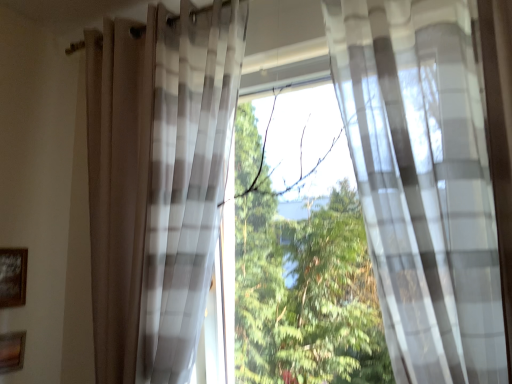
Where is `wooden framed picture at lower left, the 2th picture frame ordered from the bottom`? This screenshot has height=384, width=512. wooden framed picture at lower left, the 2th picture frame ordered from the bottom is located at coordinates (13, 276).

Is wooden framed picture at lower left, which is the first picture frame from top to bottom, placed right next to translucent white curtain at center, the 1th curtain viewed from the right?

wooden framed picture at lower left, which is the first picture frame from top to bottom, and translucent white curtain at center, the 1th curtain viewed from the right, are not in contact.

From the image's perspective, who appears lower, wooden framed picture at lower left, which is the first picture frame from top to bottom, or translucent white curtain at center, arranged as the 2th curtain when viewed from the left?

wooden framed picture at lower left, which is the first picture frame from top to bottom, is shown below in the image.

The height and width of the screenshot is (384, 512). Find the location of `the 2nd curtain above the wooden framed picture at lower left, which is the first picture frame from top to bottom (from a real-world perspective)`. the 2nd curtain above the wooden framed picture at lower left, which is the first picture frame from top to bottom (from a real-world perspective) is located at coordinates (422, 183).

Which is correct: translucent plaid curtain at center, which appears as the 2th curtain when viewed from the right, is inside wooden picture frame at lower left, marked as the second picture frame in a top-to-bottom arrangement, or outside of it?

translucent plaid curtain at center, which appears as the 2th curtain when viewed from the right, is located beyond the bounds of wooden picture frame at lower left, marked as the second picture frame in a top-to-bottom arrangement.

Is translucent plaid curtain at center, which is the 1th curtain in left-to-right order, turned away from wooden picture frame at lower left, the 1th picture frame in the bottom-to-top sequence?

No, wooden picture frame at lower left, the 1th picture frame in the bottom-to-top sequence, is not at the back of translucent plaid curtain at center, which is the 1th curtain in left-to-right order.

Considering the points (146, 157) and (23, 331), which point is behind, point (146, 157) or point (23, 331)?

Positioned behind is point (23, 331).

In terms of size, does wooden picture frame at lower left, the 1th picture frame in the bottom-to-top sequence, appear bigger or smaller than translucent white curtain at center, the 1th curtain viewed from the right?

wooden picture frame at lower left, the 1th picture frame in the bottom-to-top sequence, is smaller than translucent white curtain at center, the 1th curtain viewed from the right.

From the image's perspective, is wooden picture frame at lower left, marked as the second picture frame in a top-to-bottom arrangement, over translucent white curtain at center, arranged as the 2th curtain when viewed from the left?

No, from the image's perspective, wooden picture frame at lower left, marked as the second picture frame in a top-to-bottom arrangement, is not above translucent white curtain at center, arranged as the 2th curtain when viewed from the left.

Measure the distance from wooden picture frame at lower left, marked as the second picture frame in a top-to-bottom arrangement, to translucent white curtain at center, arranged as the 2th curtain when viewed from the left.

wooden picture frame at lower left, marked as the second picture frame in a top-to-bottom arrangement, and translucent white curtain at center, arranged as the 2th curtain when viewed from the left, are 5.85 feet apart from each other.

Between wooden picture frame at lower left, marked as the second picture frame in a top-to-bottom arrangement, and translucent white curtain at center, arranged as the 2th curtain when viewed from the left, which one has smaller width?

wooden picture frame at lower left, marked as the second picture frame in a top-to-bottom arrangement, is thinner.

Is wooden framed picture at lower left, the 2th picture frame ordered from the bottom, completely or partially outside of wooden picture frame at lower left, marked as the second picture frame in a top-to-bottom arrangement?

wooden framed picture at lower left, the 2th picture frame ordered from the bottom, is positioned outside wooden picture frame at lower left, marked as the second picture frame in a top-to-bottom arrangement.

Locate an element on the screen. picture frame above the wooden picture frame at lower left, marked as the second picture frame in a top-to-bottom arrangement (from the image's perspective) is located at coordinates (13, 276).

Can you confirm if wooden framed picture at lower left, which is the first picture frame from top to bottom, is bigger than wooden picture frame at lower left, marked as the second picture frame in a top-to-bottom arrangement?

Yes.

Which is farther, (4, 302) or (2, 355)?

Positioned behind is point (4, 302).

Can you confirm if translucent white curtain at center, the 1th curtain viewed from the right, is positioned to the right of wooden picture frame at lower left, the 1th picture frame in the bottom-to-top sequence?

Yes, translucent white curtain at center, the 1th curtain viewed from the right, is to the right of wooden picture frame at lower left, the 1th picture frame in the bottom-to-top sequence.

From a real-world perspective, is translucent white curtain at center, the 1th curtain viewed from the right, physically located above or below wooden picture frame at lower left, marked as the second picture frame in a top-to-bottom arrangement?

In terms of real-world spatial position, translucent white curtain at center, the 1th curtain viewed from the right, is above wooden picture frame at lower left, marked as the second picture frame in a top-to-bottom arrangement.

Which point is more distant from viewer, (x=345, y=66) or (x=4, y=365)?

The point (x=4, y=365) is behind.

Consider the image. Who is bigger, translucent white curtain at center, arranged as the 2th curtain when viewed from the left, or wooden picture frame at lower left, marked as the second picture frame in a top-to-bottom arrangement?

Bigger between the two is translucent white curtain at center, arranged as the 2th curtain when viewed from the left.

What's the angular difference between translucent plaid curtain at center, which appears as the 2th curtain when viewed from the right, and wooden framed picture at lower left, which is the first picture frame from top to bottom,'s facing directions?

They differ by 90 degrees in their facing directions.

Does translucent plaid curtain at center, which appears as the 2th curtain when viewed from the right, appear on the left side of wooden framed picture at lower left, which is the first picture frame from top to bottom?

No, translucent plaid curtain at center, which appears as the 2th curtain when viewed from the right, is not to the left of wooden framed picture at lower left, which is the first picture frame from top to bottom.

From the wooden framed picture at lower left, the 2th picture frame ordered from the bottom, count 1st curtains forward and point to it. Please provide its 2D coordinates.

[(158, 179)]

Are translucent plaid curtain at center, which appears as the 2th curtain when viewed from the right, and wooden framed picture at lower left, which is the first picture frame from top to bottom, making contact?

No, translucent plaid curtain at center, which appears as the 2th curtain when viewed from the right, is not in contact with wooden framed picture at lower left, which is the first picture frame from top to bottom.

Would you consider wooden picture frame at lower left, the 1th picture frame in the bottom-to-top sequence, to be distant from translucent plaid curtain at center, which is the 1th curtain in left-to-right order?

Yes, wooden picture frame at lower left, the 1th picture frame in the bottom-to-top sequence, and translucent plaid curtain at center, which is the 1th curtain in left-to-right order, are quite far apart.

Starting from the translucent plaid curtain at center, which is the 1th curtain in left-to-right order, which picture frame is the 1st one to the left? Please provide its 2D coordinates.

[(12, 351)]

Considering the positions of objects wooden picture frame at lower left, marked as the second picture frame in a top-to-bottom arrangement, and translucent plaid curtain at center, which appears as the 2th curtain when viewed from the right, in the image provided, who is in front, wooden picture frame at lower left, marked as the second picture frame in a top-to-bottom arrangement, or translucent plaid curtain at center, which appears as the 2th curtain when viewed from the right,?

translucent plaid curtain at center, which appears as the 2th curtain when viewed from the right, is in front.

From a real-world perspective, which curtain is the 2nd one above the wooden framed picture at lower left, the 2th picture frame ordered from the bottom? Please provide its 2D coordinates.

[(422, 183)]

From the wooden picture frame at lower left, the 1th picture frame in the bottom-to-top sequence, count 1st curtain to the right and point to it. Please provide its 2D coordinates.

[(158, 179)]

Considering their positions, is translucent plaid curtain at center, which appears as the 2th curtain when viewed from the right, positioned further to wooden framed picture at lower left, which is the first picture frame from top to bottom, than wooden picture frame at lower left, marked as the second picture frame in a top-to-bottom arrangement?

translucent plaid curtain at center, which appears as the 2th curtain when viewed from the right, is positioned further to the anchor wooden framed picture at lower left, which is the first picture frame from top to bottom.

Looking at the image, which one is located closer to wooden picture frame at lower left, the 1th picture frame in the bottom-to-top sequence, translucent plaid curtain at center, which is the 1th curtain in left-to-right order, or wooden framed picture at lower left, which is the first picture frame from top to bottom?

wooden framed picture at lower left, which is the first picture frame from top to bottom, lies closer to wooden picture frame at lower left, the 1th picture frame in the bottom-to-top sequence, than the other object.

Based on their spatial positions, is wooden framed picture at lower left, which is the first picture frame from top to bottom, or translucent white curtain at center, arranged as the 2th curtain when viewed from the left, further from translucent plaid curtain at center, which appears as the 2th curtain when viewed from the right?

Based on the image, wooden framed picture at lower left, which is the first picture frame from top to bottom, appears to be further to translucent plaid curtain at center, which appears as the 2th curtain when viewed from the right.

Looking at the image, which one is located closer to wooden picture frame at lower left, marked as the second picture frame in a top-to-bottom arrangement, translucent white curtain at center, the 1th curtain viewed from the right, or wooden framed picture at lower left, the 2th picture frame ordered from the bottom?

Based on the image, wooden framed picture at lower left, the 2th picture frame ordered from the bottom, appears to be nearer to wooden picture frame at lower left, marked as the second picture frame in a top-to-bottom arrangement.

From the image, which object appears to be farther from translucent plaid curtain at center, which appears as the 2th curtain when viewed from the right, wooden framed picture at lower left, which is the first picture frame from top to bottom, or wooden picture frame at lower left, the 1th picture frame in the bottom-to-top sequence?

The object further to translucent plaid curtain at center, which appears as the 2th curtain when viewed from the right, is wooden picture frame at lower left, the 1th picture frame in the bottom-to-top sequence.

Estimate the real-world distances between objects in this image. Which object is closer to wooden framed picture at lower left, which is the first picture frame from top to bottom, translucent white curtain at center, arranged as the 2th curtain when viewed from the left, or wooden picture frame at lower left, the 1th picture frame in the bottom-to-top sequence?

Among the two, wooden picture frame at lower left, the 1th picture frame in the bottom-to-top sequence, is located nearer to wooden framed picture at lower left, which is the first picture frame from top to bottom.

From the image, which object appears to be nearer to translucent white curtain at center, arranged as the 2th curtain when viewed from the left, translucent plaid curtain at center, which is the 1th curtain in left-to-right order, or wooden picture frame at lower left, marked as the second picture frame in a top-to-bottom arrangement?

translucent plaid curtain at center, which is the 1th curtain in left-to-right order, is closer to translucent white curtain at center, arranged as the 2th curtain when viewed from the left.

Which object lies further to the anchor point translucent plaid curtain at center, which is the 1th curtain in left-to-right order, translucent white curtain at center, arranged as the 2th curtain when viewed from the left, or wooden picture frame at lower left, the 1th picture frame in the bottom-to-top sequence?

The object further to translucent plaid curtain at center, which is the 1th curtain in left-to-right order, is wooden picture frame at lower left, the 1th picture frame in the bottom-to-top sequence.

At what (x,y) coordinates should I click in order to perform the action: click on curtain located between wooden framed picture at lower left, which is the first picture frame from top to bottom, and translucent white curtain at center, the 1th curtain viewed from the right, in the left-right direction. Please return your answer as a coordinate pair (x, y). This screenshot has width=512, height=384. Looking at the image, I should click on pyautogui.click(x=158, y=179).

Find the location of a particular element. This screenshot has height=384, width=512. curtain between wooden picture frame at lower left, marked as the second picture frame in a top-to-bottom arrangement, and translucent white curtain at center, arranged as the 2th curtain when viewed from the left is located at coordinates (x=158, y=179).

Locate an element on the screen. This screenshot has height=384, width=512. picture frame between wooden framed picture at lower left, the 2th picture frame ordered from the bottom, and translucent plaid curtain at center, which appears as the 2th curtain when viewed from the right is located at coordinates (12, 351).

Find the location of a particular element. This screenshot has height=384, width=512. picture frame situated between wooden framed picture at lower left, the 2th picture frame ordered from the bottom, and translucent white curtain at center, arranged as the 2th curtain when viewed from the left, from left to right is located at coordinates (12, 351).